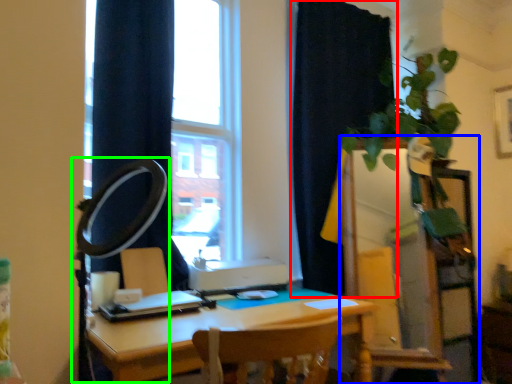
Question: Estimate the real-world distances between objects in this image. Which object is farther from curtain (highlighted by a red box), dresser (highlighted by a blue box) or table lamp (highlighted by a green box)?

Choices:
 (A) dresser
 (B) table lamp

Answer: (B)